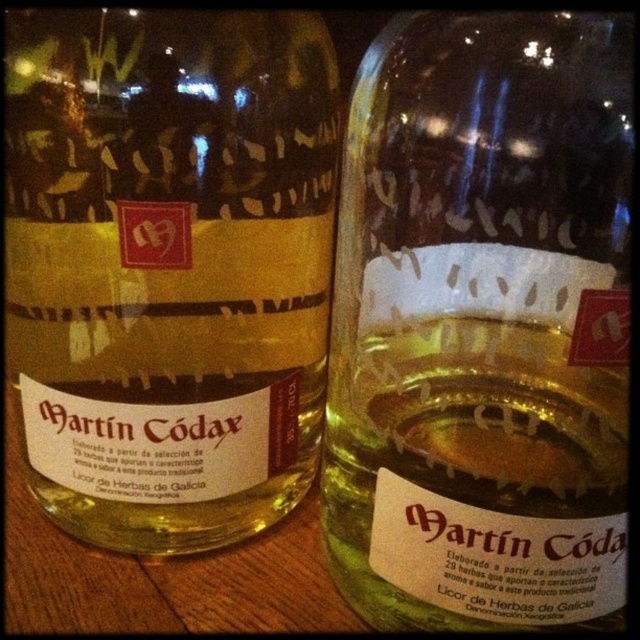
Question: Does translucent glass bottle at center have a larger size compared to matte glass bottle at center?

Choices:
 (A) no
 (B) yes

Answer: (A)

Question: Among these points, which one is nearest to the camera?

Choices:
 (A) (474, 205)
 (B) (205, 477)

Answer: (A)

Question: Can you confirm if translucent glass bottle at center is wider than matte glass bottle at center?

Choices:
 (A) yes
 (B) no

Answer: (B)

Question: Which of the following is the closest to the observer?

Choices:
 (A) matte glass bottle at center
 (B) translucent glass bottle at center

Answer: (B)

Question: Can you confirm if translucent glass bottle at center is positioned below matte glass bottle at center?

Choices:
 (A) yes
 (B) no

Answer: (A)